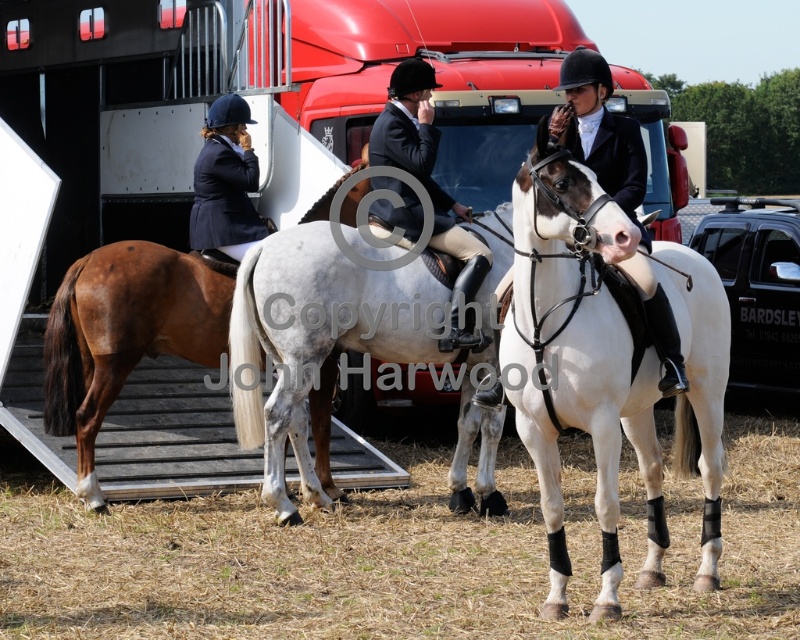
Question: Which object appears farthest from the camera in this image?

Choices:
 (A) black leather jacket at center
 (B) brown glossy horse at left

Answer: (B)

Question: Does metallic red trailer truck at center have a larger size compared to black leather jacket at center?

Choices:
 (A) no
 (B) yes

Answer: (A)

Question: Which object is closer to the camera taking this photo?

Choices:
 (A) navy blue riding jacket at upper left
 (B) metallic red trailer truck at center
 (C) white glossy horse at center
 (D) brown glossy horse at left

Answer: (C)

Question: Which point is farther to the camera?

Choices:
 (A) black leather jacket at center
 (B) brown glossy horse at left

Answer: (B)

Question: Considering the relative positions of metallic red trailer truck at center and white glossy horse at center in the image provided, where is metallic red trailer truck at center located with respect to white glossy horse at center?

Choices:
 (A) right
 (B) left

Answer: (B)

Question: Can you confirm if white glossy horse at center is bigger than black leather jacket at center?

Choices:
 (A) yes
 (B) no

Answer: (A)